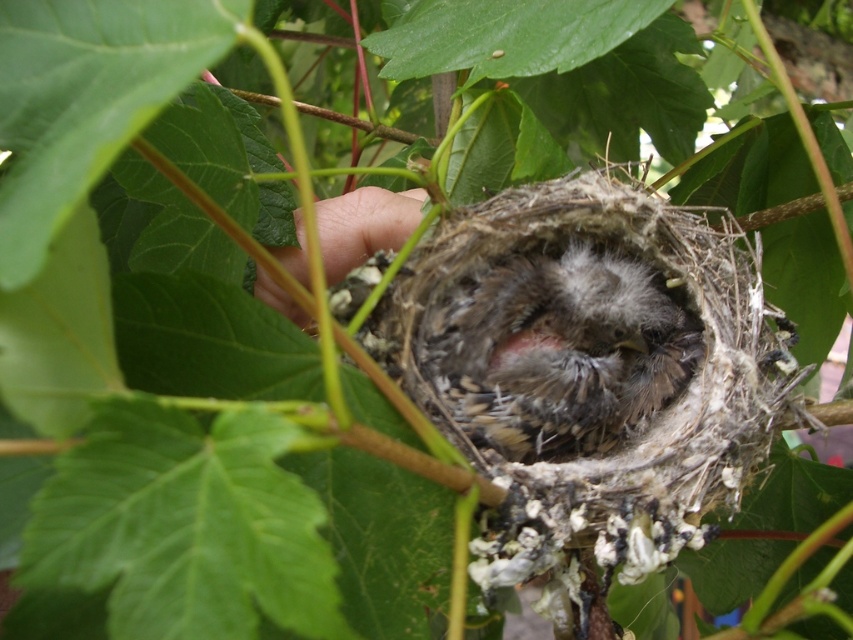
Question: Does soft brown feathers at center appear on the right side of fuzzy skin at center?

Choices:
 (A) no
 (B) yes

Answer: (B)

Question: Which point appears closest to the camera in this image?

Choices:
 (A) (306, 275)
 (B) (683, 364)

Answer: (A)

Question: Does soft brown feathers at center appear on the right side of fuzzy skin at center?

Choices:
 (A) no
 (B) yes

Answer: (B)

Question: Can you confirm if soft brown feathers at center is positioned above fuzzy skin at center?

Choices:
 (A) no
 (B) yes

Answer: (A)

Question: Which object appears closest to the camera in this image?

Choices:
 (A) soft brown feathers at center
 (B) fuzzy skin at center

Answer: (B)